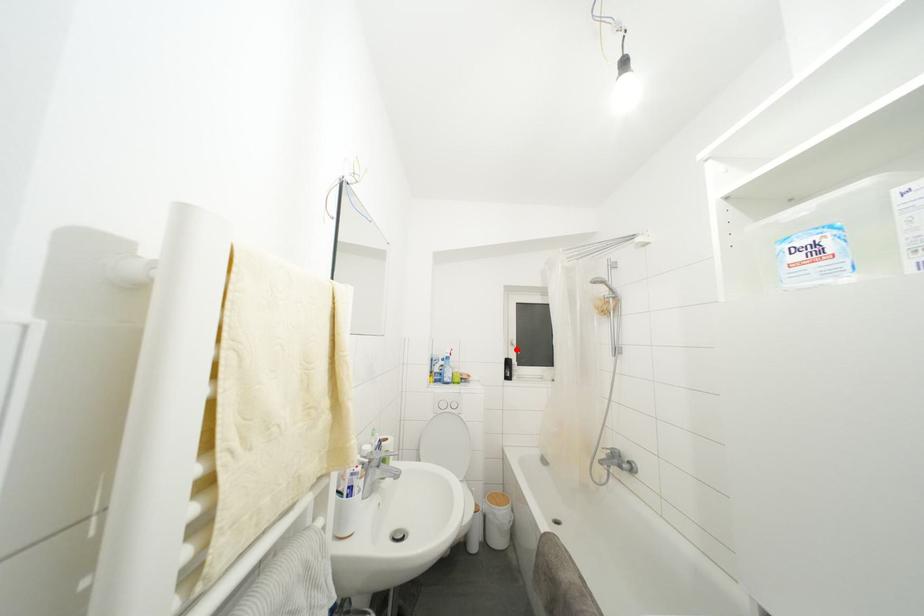
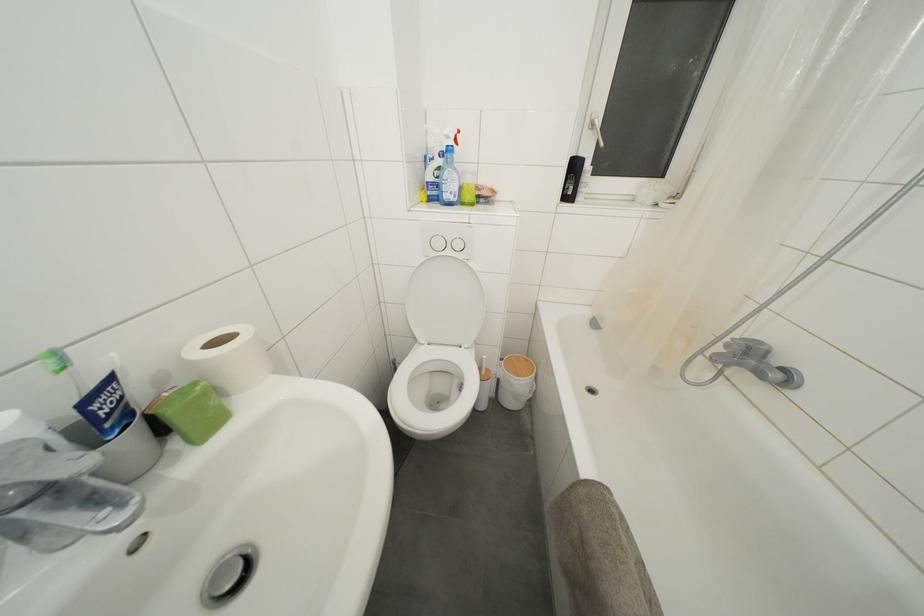
Find the pixel in the second image that matches the highlighted location in the first image.

(597, 131)